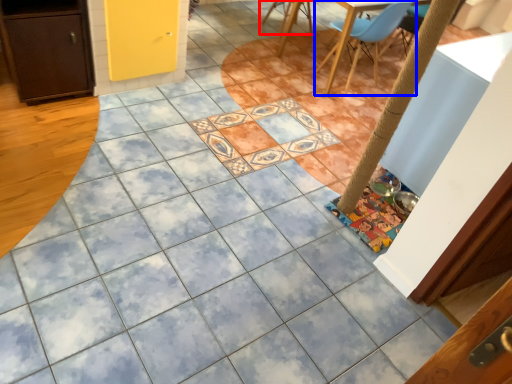
Question: Among these objects, which one is farthest to the camera, chair (highlighted by a red box) or chair (highlighted by a blue box)?

Choices:
 (A) chair
 (B) chair

Answer: (A)